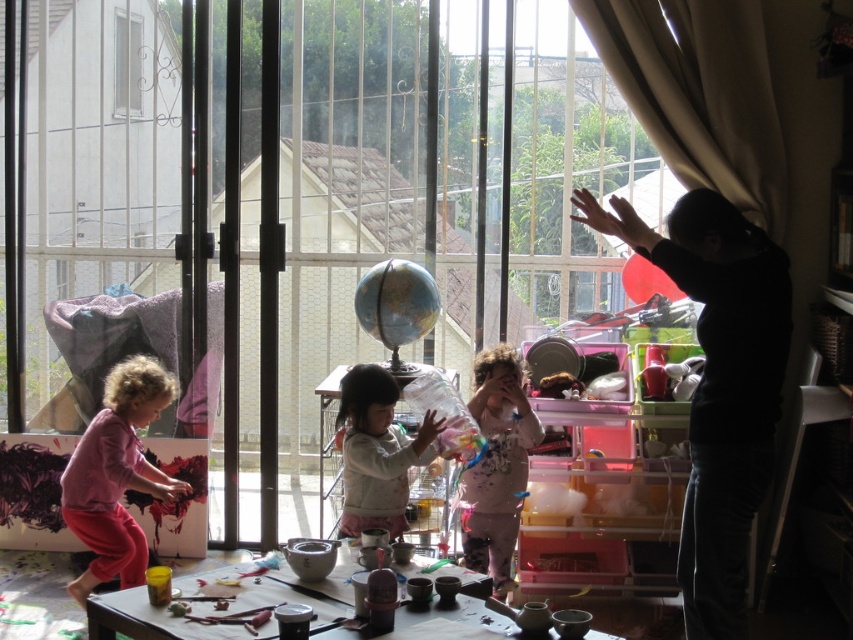
Is black matte shirt at upper right shorter than rubber balloon at center?

No, black matte shirt at upper right is not shorter than rubber balloon at center.

Who is higher up, black matte shirt at upper right or rubber balloon at center?

rubber balloon at center is higher up.

You are a GUI agent. You are given a task and a screenshot of the screen. Output one action in this format:
    pyautogui.click(x=<x>, y=<y>)
    Task: Click on the black matte shirt at upper right
    Image resolution: width=853 pixels, height=640 pixels.
    Given the screenshot: What is the action you would take?
    pyautogui.click(x=718, y=387)

Can you confirm if black matte shirt at upper right is wider than clear glass window at upper left?

Indeed, black matte shirt at upper right has a greater width compared to clear glass window at upper left.

Can you confirm if black matte shirt at upper right is positioned to the right of clear glass window at upper left?

Indeed, black matte shirt at upper right is positioned on the right side of clear glass window at upper left.

Where is `black matte shirt at upper right`? The height and width of the screenshot is (640, 853). black matte shirt at upper right is located at coordinates (718, 387).

What are the coordinates of `black matte shirt at upper right` in the screenshot? It's located at (718, 387).

Which of these two, black matte shirt at upper right or pink fabric at left, stands taller?

Standing taller between the two is black matte shirt at upper right.

Which of these two, black matte shirt at upper right or pink fabric at left, stands shorter?

With less height is pink fabric at left.

I want to click on black matte shirt at upper right, so click(718, 387).